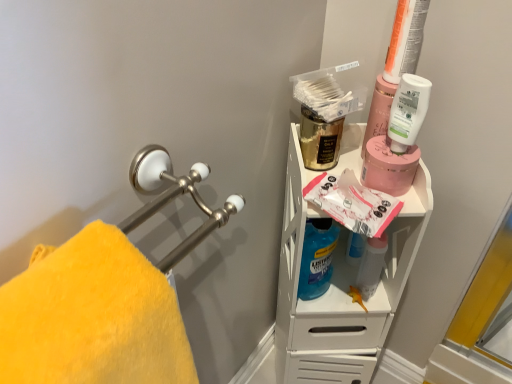
You are a GUI agent. You are given a task and a screenshot of the screen. Output one action in this format:
    pyautogui.click(x=<x>, y=<y>)
    Task: Click on the white matte lotion at upper right, marked as the 3th cleaning product in a bottom-to-top arrangement
    The image size is (512, 384).
    Given the screenshot: What is the action you would take?
    pyautogui.click(x=408, y=111)

Describe the element at coordinates (317, 257) in the screenshot. I see `blue translucent liquid at center, which is the 2th cleaning product from top to bottom` at that location.

Where is `gold metallic mouthwash at upper center, placed as the 1th mouthwash when sorted from left to right`? The height and width of the screenshot is (384, 512). gold metallic mouthwash at upper center, placed as the 1th mouthwash when sorted from left to right is located at coordinates (319, 140).

Where is `matte gray spray bottle at center, which appears as the 2th cleaning product when viewed from the right`? matte gray spray bottle at center, which appears as the 2th cleaning product when viewed from the right is located at coordinates (371, 266).

Describe the element at coordinates (388, 166) in the screenshot. I see `pink matte jar at upper right` at that location.

You are a GUI agent. You are given a task and a screenshot of the screen. Output one action in this format:
    pyautogui.click(x=<x>, y=<y>)
    Task: Click on the pink matte jar at upper right
    The width and height of the screenshot is (512, 384).
    Given the screenshot: What is the action you would take?
    pyautogui.click(x=388, y=166)

Identify the location of white matte lotion at upper right, marked as the first cleaning product in a top-to-bottom arrangement. pyautogui.click(x=408, y=111).

At what (x,y) coordinates should I click in order to perform the action: click on mouthwash that is the 2nd object located in front of the blue translucent liquid at center, which is the 2th cleaning product from top to bottom. Please return your answer as a coordinate pair (x, y). Looking at the image, I should click on (379, 110).

Could you measure the distance between translucent plastic mouthwash at upper right, which appears as the 1th mouthwash when viewed from the right, and blue translucent liquid at center, which is the 2th cleaning product from top to bottom?

A distance of 9.80 inches exists between translucent plastic mouthwash at upper right, which appears as the 1th mouthwash when viewed from the right, and blue translucent liquid at center, which is the 2th cleaning product from top to bottom.

Which of these two, translucent plastic mouthwash at upper right, arranged as the second mouthwash when viewed from the left, or blue translucent liquid at center, which is the 2th cleaning product from top to bottom, is wider?

Wider between the two is blue translucent liquid at center, which is the 2th cleaning product from top to bottom.

Considering the sizes of objects translucent plastic mouthwash at upper right, which appears as the 1th mouthwash when viewed from the right, and blue translucent liquid at center, which is the 2th cleaning product from top to bottom, in the image provided, who is smaller, translucent plastic mouthwash at upper right, which appears as the 1th mouthwash when viewed from the right, or blue translucent liquid at center, which is the 2th cleaning product from top to bottom,?

Smaller between the two is translucent plastic mouthwash at upper right, which appears as the 1th mouthwash when viewed from the right.

Looking at this image, considering the positions of objects translucent plastic mouthwash at upper right, arranged as the second mouthwash when viewed from the left, and matte gray spray bottle at center, which appears as the 2th cleaning product when viewed from the right, in the image provided, who is more to the left, translucent plastic mouthwash at upper right, arranged as the second mouthwash when viewed from the left, or matte gray spray bottle at center, which appears as the 2th cleaning product when viewed from the right,?

matte gray spray bottle at center, which appears as the 2th cleaning product when viewed from the right, is more to the left.

From a real-world perspective, is translucent plastic mouthwash at upper right, which appears as the 1th mouthwash when viewed from the right, located higher than matte gray spray bottle at center, which appears as the 2th cleaning product when viewed from the right?

Yes, from a real-world perspective, translucent plastic mouthwash at upper right, which appears as the 1th mouthwash when viewed from the right, is over matte gray spray bottle at center, which appears as the 2th cleaning product when viewed from the right

In order to click on the 2nd mouthwash positioned above the matte gray spray bottle at center, marked as the 3th cleaning product in a top-to-bottom arrangement (from the image's perspective) in this screenshot , I will do `click(379, 110)`.

Looking at this image, would you say translucent plastic mouthwash at upper right, which appears as the 1th mouthwash when viewed from the right, contains matte gray spray bottle at center, which appears as the first cleaning product when ordered from the bottom?

That's incorrect, matte gray spray bottle at center, which appears as the first cleaning product when ordered from the bottom, is not inside translucent plastic mouthwash at upper right, which appears as the 1th mouthwash when viewed from the right.

Which object is closer to the camera, yellow plush towel at left or gold metallic mouthwash at upper center, which is the second mouthwash from right to left?

yellow plush towel at left.

Between yellow plush towel at left and gold metallic mouthwash at upper center, which is the second mouthwash from right to left, which one has larger width?

yellow plush towel at left is wider.

How different are the orientations of yellow plush towel at left and gold metallic mouthwash at upper center, placed as the 1th mouthwash when sorted from left to right, in degrees?

53.2 degrees.

Is yellow plush towel at left facing away from gold metallic mouthwash at upper center, which is the second mouthwash from right to left?

No, yellow plush towel at left is not facing the opposite direction of gold metallic mouthwash at upper center, which is the second mouthwash from right to left.

Is matte white shelf at upper right taller or shorter than translucent plastic mouthwash at upper right, arranged as the second mouthwash when viewed from the left?

Considering their sizes, matte white shelf at upper right has more height than translucent plastic mouthwash at upper right, arranged as the second mouthwash when viewed from the left.

From a real-world perspective, is matte white shelf at upper right positioned over translucent plastic mouthwash at upper right, arranged as the second mouthwash when viewed from the left, based on gravity?

No, from a real-world perspective, matte white shelf at upper right is not over translucent plastic mouthwash at upper right, arranged as the second mouthwash when viewed from the left

Measure the distance between matte white shelf at upper right and translucent plastic mouthwash at upper right, which appears as the 1th mouthwash when viewed from the right.

matte white shelf at upper right is 11.60 inches from translucent plastic mouthwash at upper right, which appears as the 1th mouthwash when viewed from the right.

Who is smaller, matte white shelf at upper right or translucent plastic mouthwash at upper right, which appears as the 1th mouthwash when viewed from the right?

Smaller between the two is translucent plastic mouthwash at upper right, which appears as the 1th mouthwash when viewed from the right.

Is yellow plush towel at left wider than matte gray spray bottle at center, the second cleaning product positioned from the left?

Yes.

From the image's perspective, is yellow plush towel at left on matte gray spray bottle at center, which appears as the first cleaning product when ordered from the bottom?

Indeed, from the image's perspective, yellow plush towel at left is shown above matte gray spray bottle at center, which appears as the first cleaning product when ordered from the bottom.

Is yellow plush towel at left directly adjacent to matte gray spray bottle at center, marked as the 3th cleaning product in a top-to-bottom arrangement?

No, yellow plush towel at left is not next to matte gray spray bottle at center, marked as the 3th cleaning product in a top-to-bottom arrangement.

Is yellow plush towel at left bigger than matte gray spray bottle at center, the second cleaning product positioned from the left?

Yes, yellow plush towel at left is bigger than matte gray spray bottle at center, the second cleaning product positioned from the left.

Can you confirm if pink matte jar at upper right is smaller than white matte lotion at upper right, the third cleaning product positioned from the left?

Incorrect, pink matte jar at upper right is not smaller in size than white matte lotion at upper right, the third cleaning product positioned from the left.

Does pink matte jar at upper right lie in front of white matte lotion at upper right, marked as the first cleaning product in a top-to-bottom arrangement?

No, the depth of pink matte jar at upper right is greater than that of white matte lotion at upper right, marked as the first cleaning product in a top-to-bottom arrangement.

Is pink matte jar at upper right next to white matte lotion at upper right, marked as the first cleaning product in a top-to-bottom arrangement?

Indeed, pink matte jar at upper right and white matte lotion at upper right, marked as the first cleaning product in a top-to-bottom arrangement, are beside each other and touching.

Is pink matte jar at upper right facing towards white matte lotion at upper right, marked as the 3th cleaning product in a bottom-to-top arrangement?

No, pink matte jar at upper right is not oriented towards white matte lotion at upper right, marked as the 3th cleaning product in a bottom-to-top arrangement.

Which is correct: yellow plush towel at left is inside white matte lotion at upper right, marked as the first cleaning product in a top-to-bottom arrangement, or outside of it?

yellow plush towel at left is not inside white matte lotion at upper right, marked as the first cleaning product in a top-to-bottom arrangement, it's outside.

Which object is closer to the camera taking this photo, yellow plush towel at left or white matte lotion at upper right, the third cleaning product positioned from the left?

yellow plush towel at left is closer to the camera.

Identify the location of cleaning product above the yellow plush towel at left (from a real-world perspective). (408, 111).

Which object is positioned more to the right, yellow plush towel at left or white matte lotion at upper right, marked as the 3th cleaning product in a bottom-to-top arrangement?

Positioned to the right is white matte lotion at upper right, marked as the 3th cleaning product in a bottom-to-top arrangement.

From a real-world perspective, count 2nd mouthwashs upward from the blue translucent liquid at center, the first cleaning product positioned from the left, and point to it. Please provide its 2D coordinates.

[(379, 110)]

Identify the location of mouthwash located on the right of matte gray spray bottle at center, which appears as the first cleaning product when ordered from the bottom. This screenshot has height=384, width=512. (379, 110).

Based on the photo, looking at the image, which one is located further to blue translucent liquid at center, the first cleaning product positioned from the left, matte gray spray bottle at center, marked as the 3th cleaning product in a top-to-bottom arrangement, or yellow plush towel at left?

Among the two, yellow plush towel at left is located further to blue translucent liquid at center, the first cleaning product positioned from the left.

From the image, which object appears to be nearer to white matte lotion at upper right, marked as the 3th cleaning product in a bottom-to-top arrangement, yellow plush towel at left or pink matte jar at upper right?

pink matte jar at upper right.

Considering their positions, is white matte lotion at upper right, marked as the first cleaning product in a top-to-bottom arrangement, positioned further to translucent plastic mouthwash at upper right, arranged as the second mouthwash when viewed from the left, than pink matte jar at upper right?

The object further to translucent plastic mouthwash at upper right, arranged as the second mouthwash when viewed from the left, is pink matte jar at upper right.

In the scene shown: Which object lies further to the anchor point matte white shelf at upper right, white matte lotion at upper right, marked as the first cleaning product in a top-to-bottom arrangement, or blue translucent liquid at center, which is the 2th cleaning product from top to bottom?

white matte lotion at upper right, marked as the first cleaning product in a top-to-bottom arrangement, lies further to matte white shelf at upper right than the other object.

Which object lies further to the anchor point gold metallic mouthwash at upper center, which is the second mouthwash from right to left, translucent plastic mouthwash at upper right, which appears as the 1th mouthwash when viewed from the right, or white matte lotion at upper right, marked as the first cleaning product in a top-to-bottom arrangement?

white matte lotion at upper right, marked as the first cleaning product in a top-to-bottom arrangement.

Based on their spatial positions, is pink matte jar at upper right or white matte lotion at upper right, which ranks as the first cleaning product in right-to-left order, further from gold metallic mouthwash at upper center, placed as the 1th mouthwash when sorted from left to right?

white matte lotion at upper right, which ranks as the first cleaning product in right-to-left order, is positioned further to the anchor gold metallic mouthwash at upper center, placed as the 1th mouthwash when sorted from left to right.

From the image, which object appears to be nearer to blue translucent liquid at center, which is the 2th cleaning product from top to bottom, matte gray spray bottle at center, marked as the 3th cleaning product in a top-to-bottom arrangement, or matte white shelf at upper right?

matte gray spray bottle at center, marked as the 3th cleaning product in a top-to-bottom arrangement, is positioned closer to the anchor blue translucent liquid at center, which is the 2th cleaning product from top to bottom.

Looking at the image, which one is located closer to matte white shelf at upper right, yellow plush towel at left or pink matte jar at upper right?

pink matte jar at upper right lies closer to matte white shelf at upper right than the other object.

The image size is (512, 384). I want to click on shelf between yellow plush towel at left and matte gray spray bottle at center, which appears as the first cleaning product when ordered from the bottom, from front to back, so click(340, 288).

Image resolution: width=512 pixels, height=384 pixels. In order to click on shelf positioned between yellow plush towel at left and blue translucent liquid at center, the third cleaning product from the right, from near to far in this screenshot , I will do `click(340, 288)`.

Locate an element on the screen. cleaning product between white matte lotion at upper right, marked as the 3th cleaning product in a bottom-to-top arrangement, and matte gray spray bottle at center, which appears as the first cleaning product when ordered from the bottom, in the up-down direction is located at coordinates (317, 257).

Find the location of a particular element. This screenshot has height=384, width=512. shelf between yellow plush towel at left and white matte lotion at upper right, the third cleaning product positioned from the left, from left to right is located at coordinates pyautogui.click(x=340, y=288).